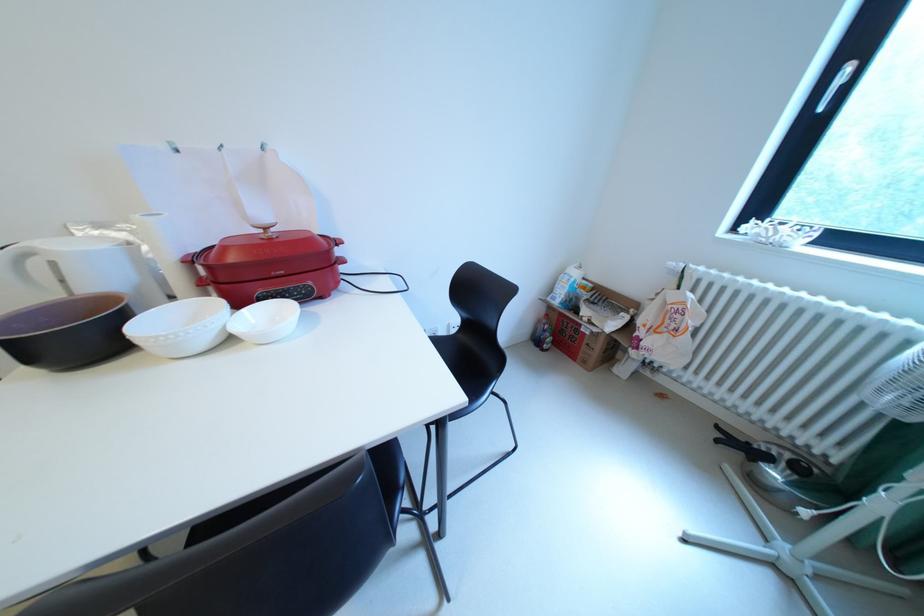
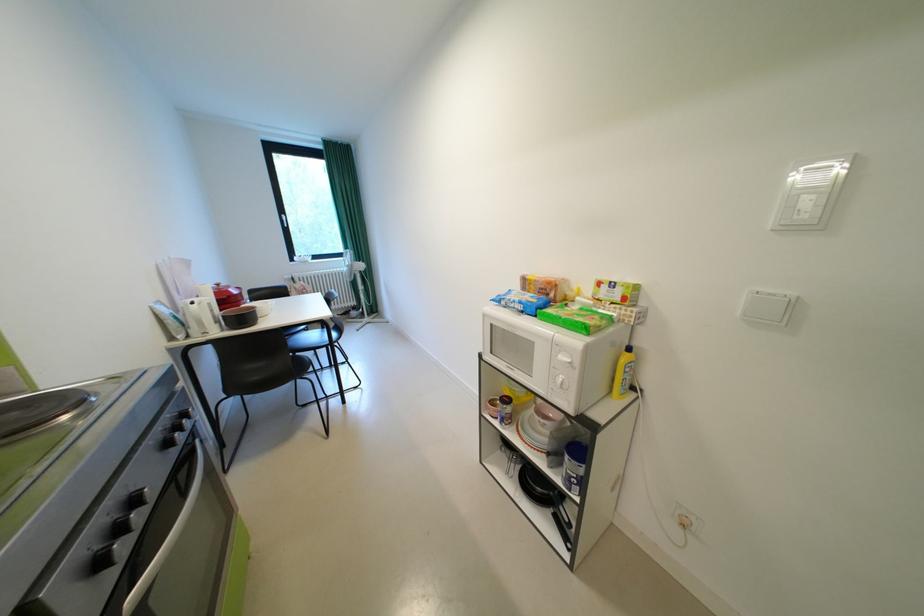
In the second image, find the point that corresponds to pixel 275 229 in the first image.

(228, 286)